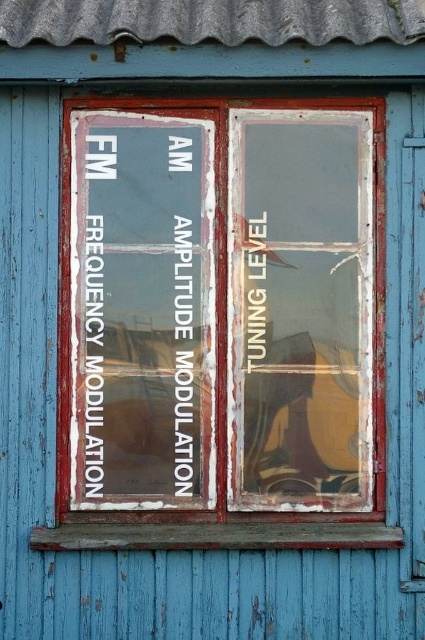
You are standing in front of the repurposed window display panel. There is a point marked at coordinates point (223, 307). Based on the scene description, can you determine what this point is located on?

The point (223, 307) is located on the chipped paint window at center.

You are standing in front of the building and notice the chipped paint window at center and the transparent glass guitar at right. Which object is positioned higher relative to the other?

The chipped paint window at center is located above the transparent glass guitar at right, so it is positioned higher.

You are holding a 10 cm ruler and want to measure the distance between the chipped paint window at center and the transparent glass guitar at right. Can you fit the ruler between them without it overlapping either object?

The distance between the chipped paint window at center and the transparent glass guitar at right is 8.50 centimeters. Since the ruler is 10 cm long, it will overlap both objects when placed between them.